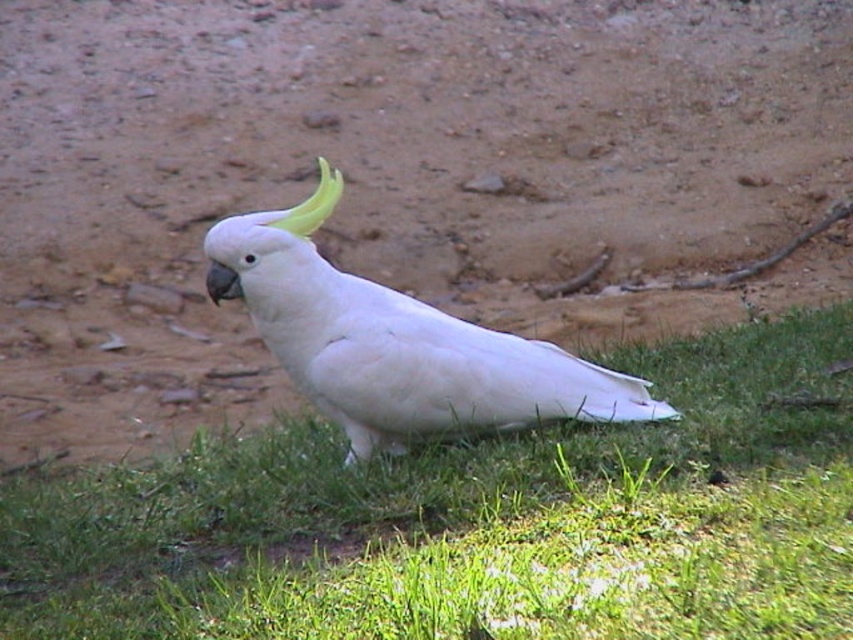
You are a gardener who wants to plant a flower in the brown soil at center and the green grass at lower center. Based on their positions, which area would you choose to plant the flower where it can get more sunlight?

The brown soil at center is located above the green grass at lower center, so planting the flower in the brown soil at center would provide better sunlight exposure since it is positioned higher and less obstructed.

You are a photographer trying to capture the white feathered parrot at center. You notice the brown soil at center in the background. Which object is smaller in the image?

The brown soil at center is smaller compared to the white feathered parrot at center.